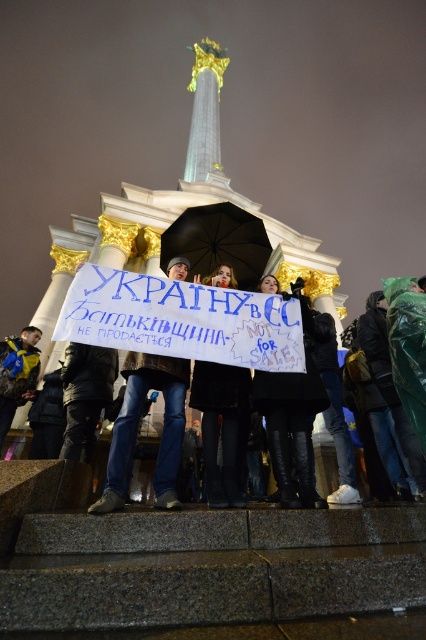
In the nighttime protest scene, there are two people wearing blue jeans at center and black leather pants at lower center. Which one is positioned to the right of the other?

The blue jeans at center is positioned to the right of the black leather pants at lower center.